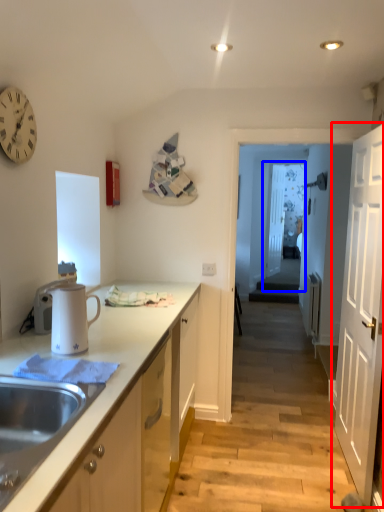
Question: Which point is further to the camera, door (highlighted by a red box) or glass door (highlighted by a blue box)?

Choices:
 (A) door
 (B) glass door

Answer: (B)